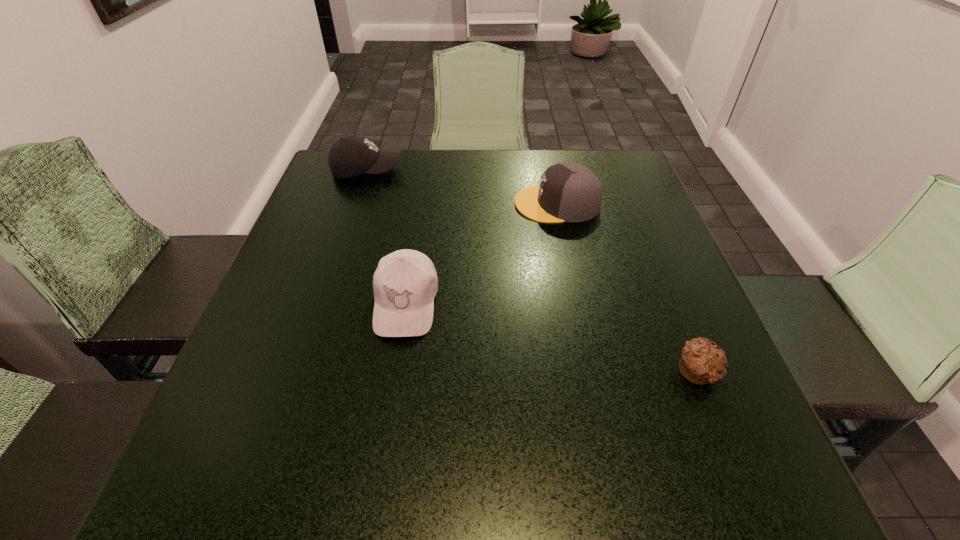
You are a GUI agent. You are given a task and a screenshot of the screen. Output one action in this format:
    pyautogui.click(x=<x>, y=<y>)
    Task: Click on the free space between the second farthest object and the leftmost object
    This screenshot has width=960, height=540.
    Given the screenshot: What is the action you would take?
    pyautogui.click(x=462, y=187)

This screenshot has width=960, height=540. I want to click on vacant space that's between the right baseball cap and the farther baseball cap, so click(x=386, y=237).

Locate an element on the screen. This screenshot has height=540, width=960. free spot between the farther baseball cap and the second object from left to right is located at coordinates (386, 237).

Find the location of a particular element. vacant space that's between the shortest object and the left baseball cap is located at coordinates [533, 271].

You are a GUI agent. You are given a task and a screenshot of the screen. Output one action in this format:
    pyautogui.click(x=<x>, y=<y>)
    Task: Click on the empty space between the left baseball cap and the second object from left to right
    The image size is (960, 540).
    Given the screenshot: What is the action you would take?
    pyautogui.click(x=386, y=237)

The image size is (960, 540). Find the location of `vacant area that lies between the right baseball cap and the nearest object`. vacant area that lies between the right baseball cap and the nearest object is located at coordinates (552, 338).

At what (x,y) coordinates should I click in order to perform the action: click on free spot between the cap and the leftmost object. Please return your answer as a coordinate pair (x, y). Looking at the image, I should click on (462, 187).

Identify the location of object that stands as the second closest to the cap. The height and width of the screenshot is (540, 960). (352, 155).

Identify which object is the third closest to the right baseball cap. Please provide its 2D coordinates. Your answer should be formatted as a tuple, i.e. [(x, y)], where the tuple contains the x and y coordinates of a point satisfying the conditions above.

[(701, 362)]

I want to click on free spot that satisfies the following two spatial constraints: 1. on the front-facing side of the nearest object; 2. on the left side of the right baseball cap, so click(395, 372).